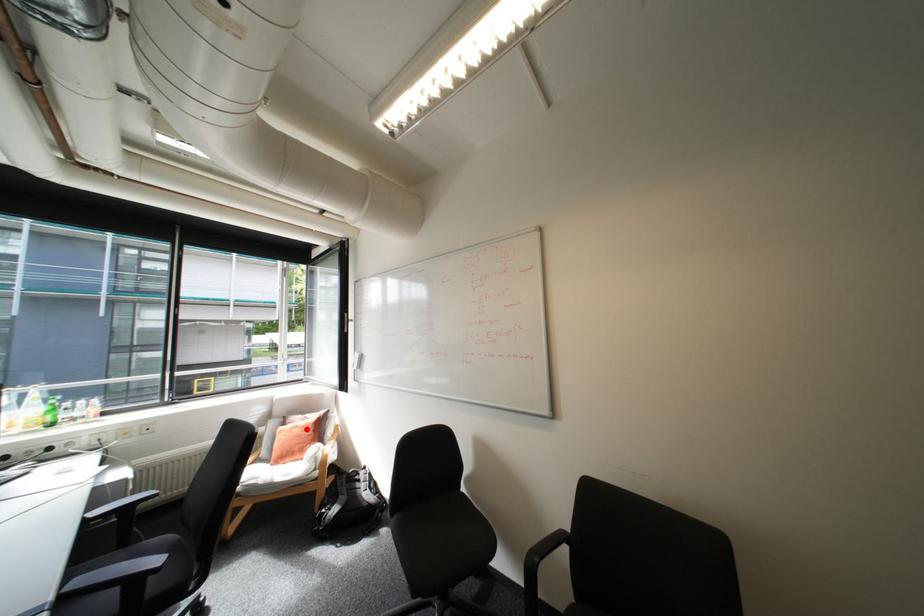
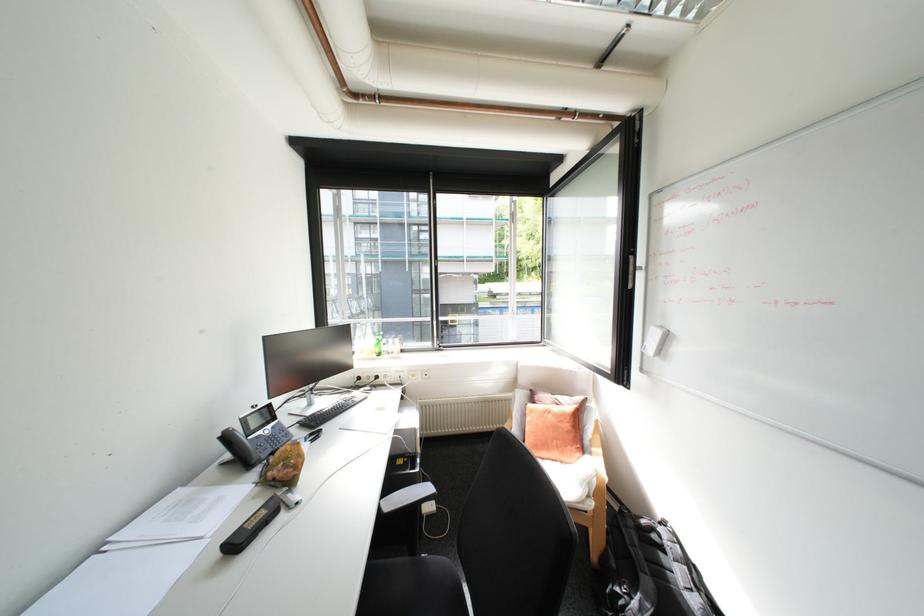
In the second image, find the point that corresponds to the highlighted location in the first image.

(561, 416)